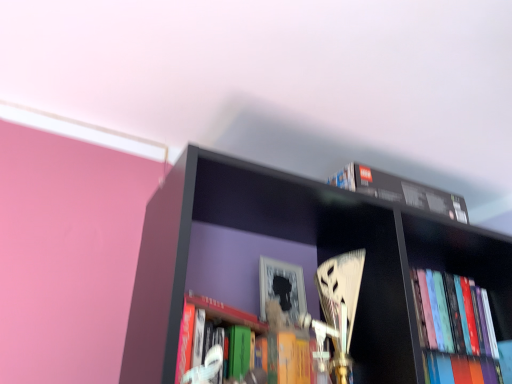
Question: From their relative heights in the image, would you say hardcover books at right, positioned as the 1th book in bottom-to-top order, is taller or shorter than black matte book at upper right, the first book when ordered from top to bottom?

Choices:
 (A) short
 (B) tall

Answer: (B)

Question: From a real-world perspective, is hardcover books at right, which ranks as the 2th book in top-to-bottom order, physically located above or below black matte book at upper right, which is the 2th book in bottom-to-top order?

Choices:
 (A) below
 (B) above

Answer: (A)

Question: Is hardcover books at right, positioned as the 1th book in bottom-to-top order, to the left or to the right of black matte book at upper right, which is the 2th book in bottom-to-top order, in the image?

Choices:
 (A) right
 (B) left

Answer: (A)

Question: From the image's perspective, is black matte book at upper right, which is the 2th book in bottom-to-top order, located above or below hardcover books at right, which ranks as the 2th book in top-to-bottom order?

Choices:
 (A) above
 (B) below

Answer: (A)

Question: Based on their sizes in the image, would you say black matte book at upper right, which is the 2th book in bottom-to-top order, is bigger or smaller than hardcover books at right, positioned as the 1th book in bottom-to-top order?

Choices:
 (A) small
 (B) big

Answer: (A)

Question: Is black matte book at upper right, the first book when ordered from top to bottom, inside the boundaries of hardcover books at right, positioned as the 1th book in bottom-to-top order, or outside?

Choices:
 (A) outside
 (B) inside

Answer: (A)

Question: In the image, is black matte book at upper right, the first book when ordered from top to bottom, positioned in front of or behind hardcover books at right, which ranks as the 2th book in top-to-bottom order?

Choices:
 (A) front
 (B) behind

Answer: (A)